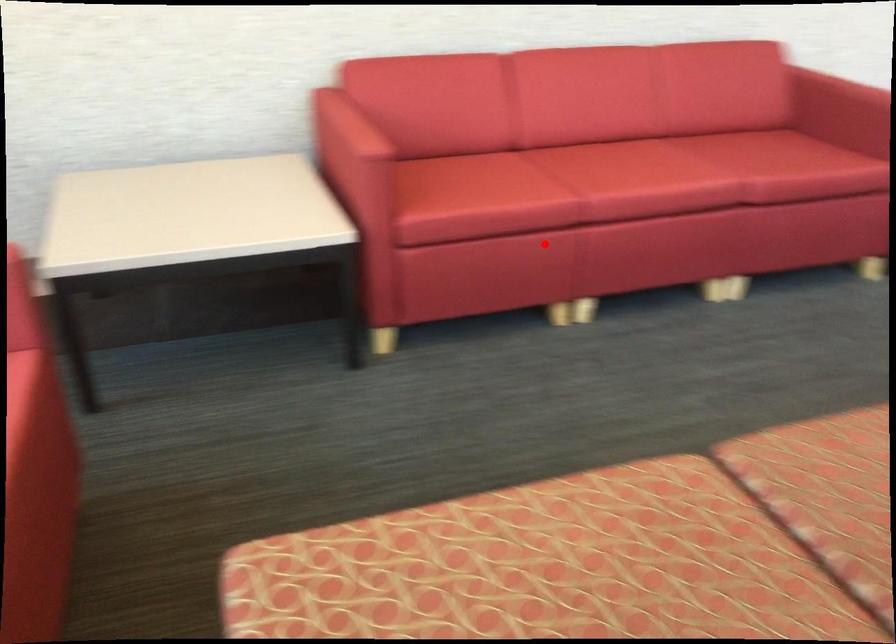
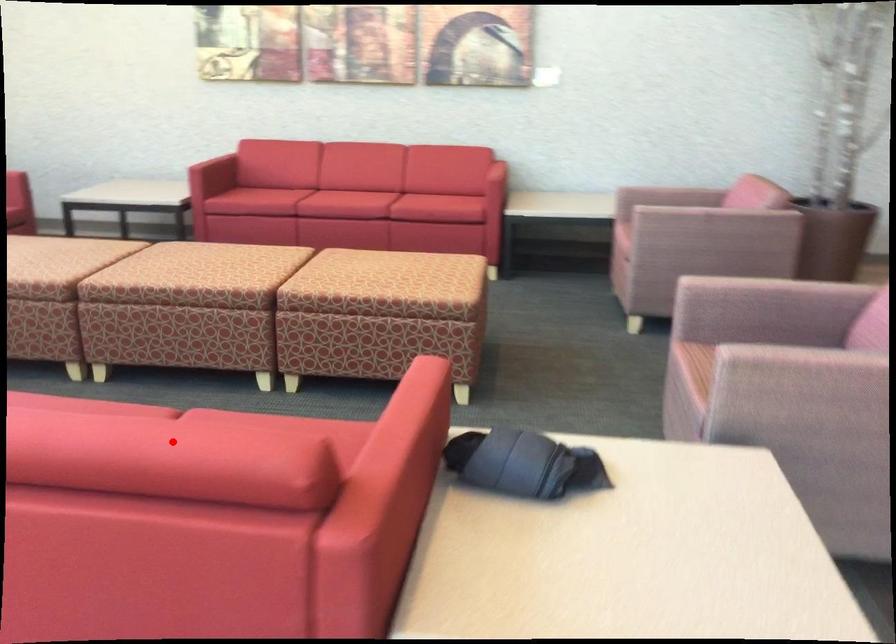
I am providing you with two images of the same scene from different viewpoints. A red point is marked on the first image and another point is marked on the second image. Does the point marked in image1 correspond to the same location as the one in image2?

No